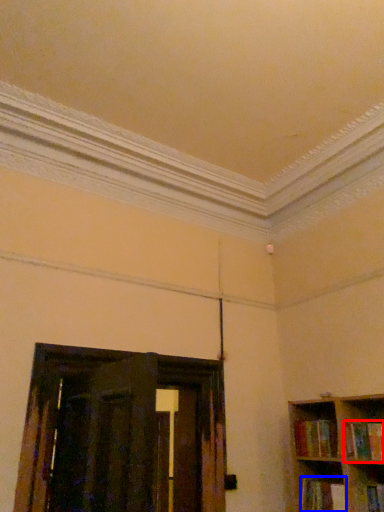
Question: Which object is closer to the camera taking this photo, book (highlighted by a red box) or book (highlighted by a blue box)?

Choices:
 (A) book
 (B) book

Answer: (A)